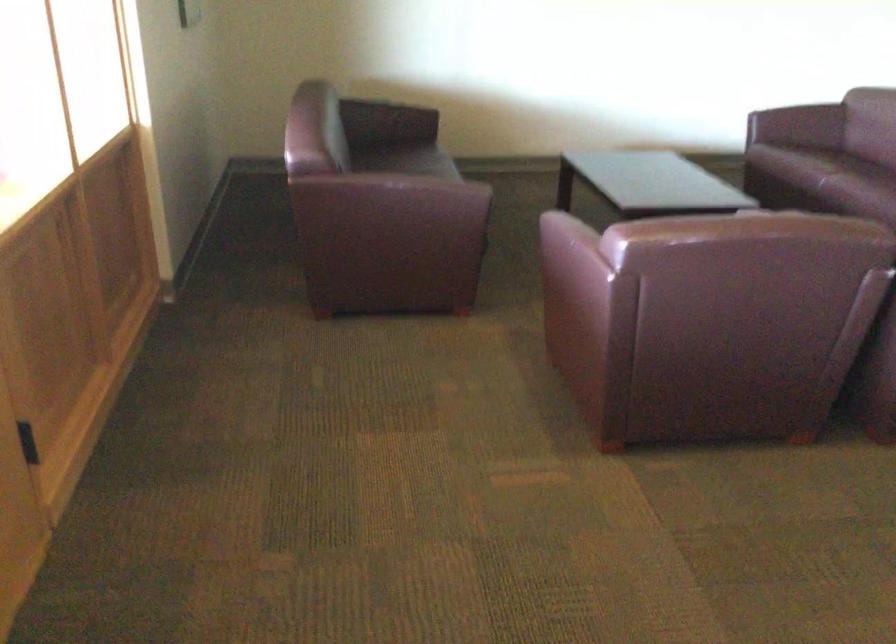
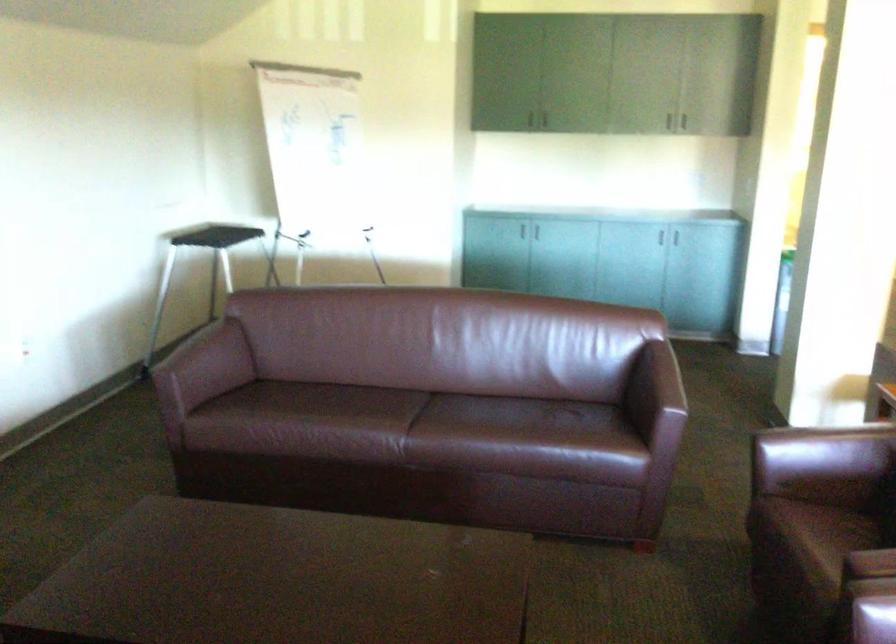
The first image is from the beginning of the video and the second image is from the end. How did the camera likely rotate when shooting the video?

The camera's rotation is toward right-down.